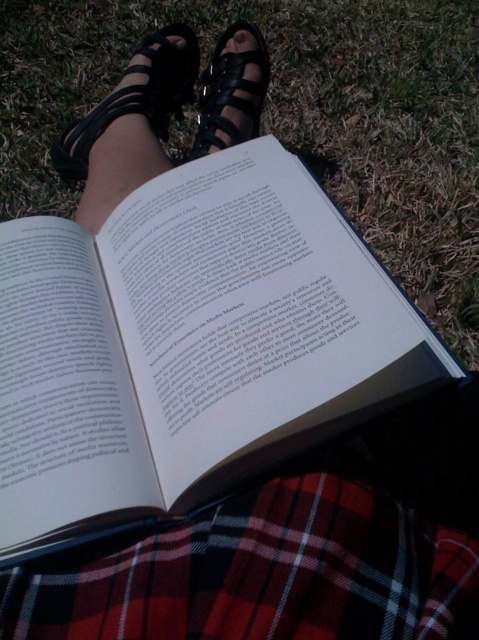
In the scene shown: Is red plaid skirt at lower center positioned at the back of black leather sandal at upper left?

That is False.

Can you confirm if red plaid skirt at lower center is bigger than black leather sandal at upper left?

Actually, red plaid skirt at lower center might be smaller than black leather sandal at upper left.

Describe the element at coordinates (264, 573) in the screenshot. I see `red plaid skirt at lower center` at that location.

Identify the location of red plaid skirt at lower center. This screenshot has width=479, height=640. (264, 573).

Between red plaid skirt at lower center and black leather sandal at center, which one appears on the right side from the viewer's perspective?

Positioned to the right is red plaid skirt at lower center.

Can you confirm if red plaid skirt at lower center is shorter than black leather sandal at center?

Indeed, red plaid skirt at lower center has a lesser height compared to black leather sandal at center.

Is point (126, 625) in front of point (216, 61)?

Yes, it is in front of point (216, 61).

At what (x,y) coordinates should I click in order to perform the action: click on red plaid skirt at lower center. Please return your answer as a coordinate pair (x, y). The width and height of the screenshot is (479, 640). Looking at the image, I should click on (264, 573).

Find the location of a particular element. The image size is (479, 640). green grass at center is located at coordinates (291, 116).

Who is more distant from viewer, (414,52) or (252,76)?

The point (414,52) is behind.

Identify the location of green grass at center. (291, 116).